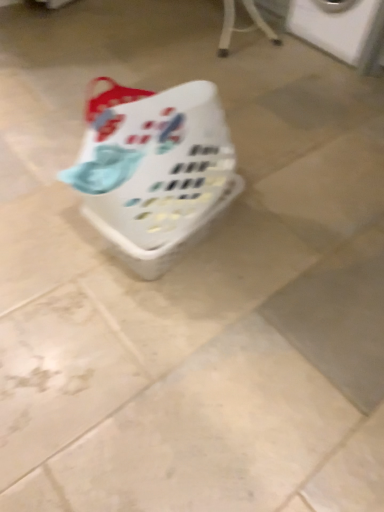
You are a GUI agent. You are given a task and a screenshot of the screen. Output one action in this format:
    pyautogui.click(x=<x>, y=<y>)
    Task: Click on the vacant area situated to the left side of white plastic basket at center
    This screenshot has height=512, width=384.
    Given the screenshot: What is the action you would take?
    pyautogui.click(x=43, y=230)